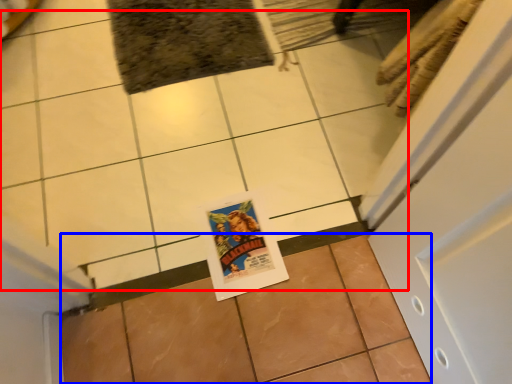
Question: Which of the following is the closest to the observer, ceramic tile (highlighted by a red box) or ceramic tile (highlighted by a blue box)?

Choices:
 (A) ceramic tile
 (B) ceramic tile

Answer: (B)